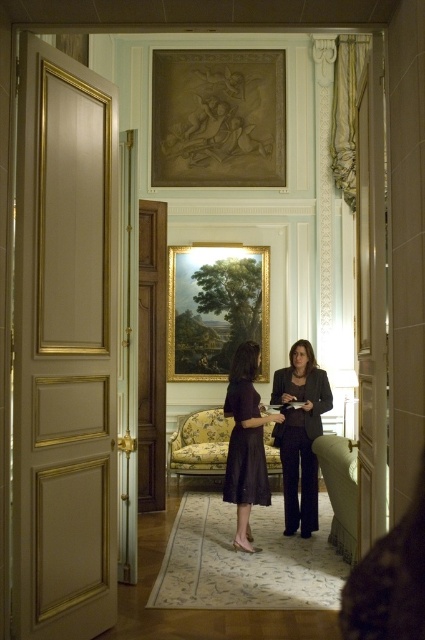
Question: Can you confirm if matte black blazer at center is bigger than matte black dress at center?

Choices:
 (A) yes
 (B) no

Answer: (B)

Question: Which object appears closest to the camera in this image?

Choices:
 (A) black satin dress at center
 (B) matte black dress at center
 (C) matte black blazer at center

Answer: (B)

Question: Does matte black dress at center lie in front of black satin dress at center?

Choices:
 (A) yes
 (B) no

Answer: (A)

Question: Does matte black blazer at center have a lesser width compared to matte black dress at center?

Choices:
 (A) no
 (B) yes

Answer: (B)

Question: Which point is closer to the camera?

Choices:
 (A) (263, 492)
 (B) (229, 499)
 (C) (306, 467)

Answer: (B)

Question: Which object is closer to the camera taking this photo?

Choices:
 (A) matte black blazer at center
 (B) black satin dress at center

Answer: (B)